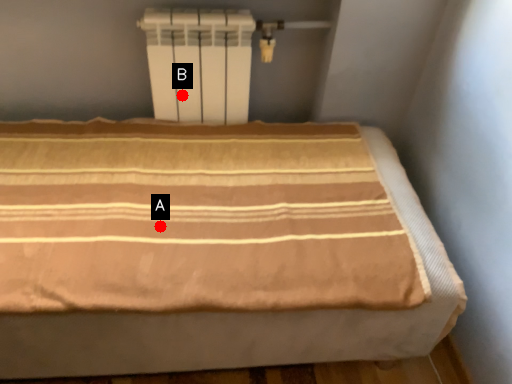
Question: Two points are circled on the image, labeled by A and B beside each circle. Which point is farther from the camera taking this photo?

Choices:
 (A) A is further
 (B) B is further

Answer: (B)